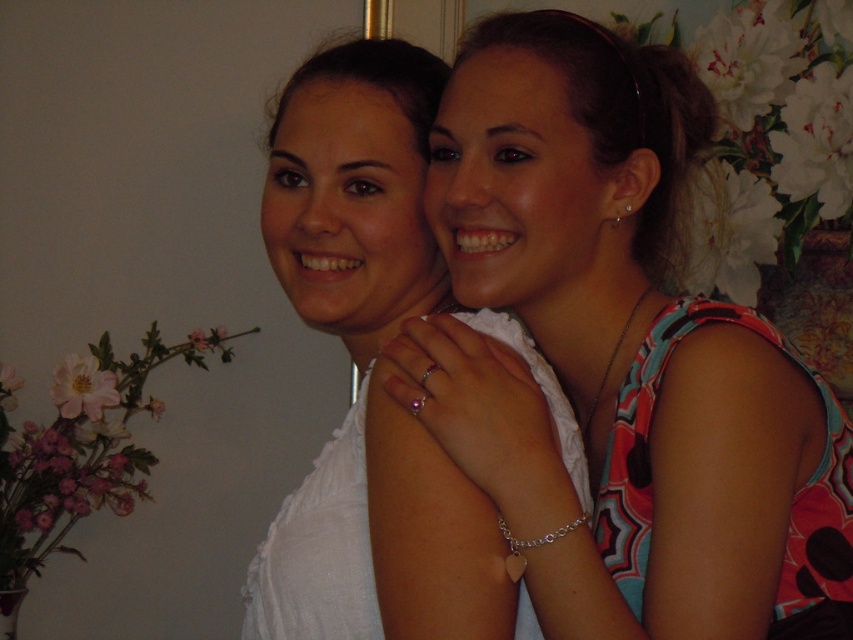
Which is more to the right, multicolored fabric dress at center or white fabric dress at center?

Positioned to the right is multicolored fabric dress at center.

Can you confirm if multicolored fabric dress at center is positioned to the right of white fabric dress at center?

Yes, multicolored fabric dress at center is to the right of white fabric dress at center.

Where is `multicolored fabric dress at center`? Image resolution: width=853 pixels, height=640 pixels. multicolored fabric dress at center is located at coordinates (619, 355).